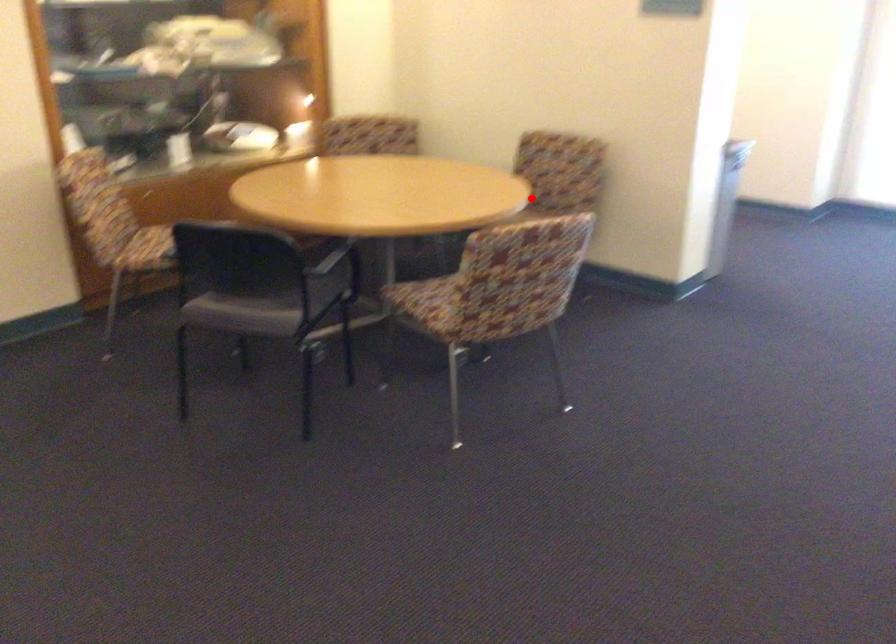
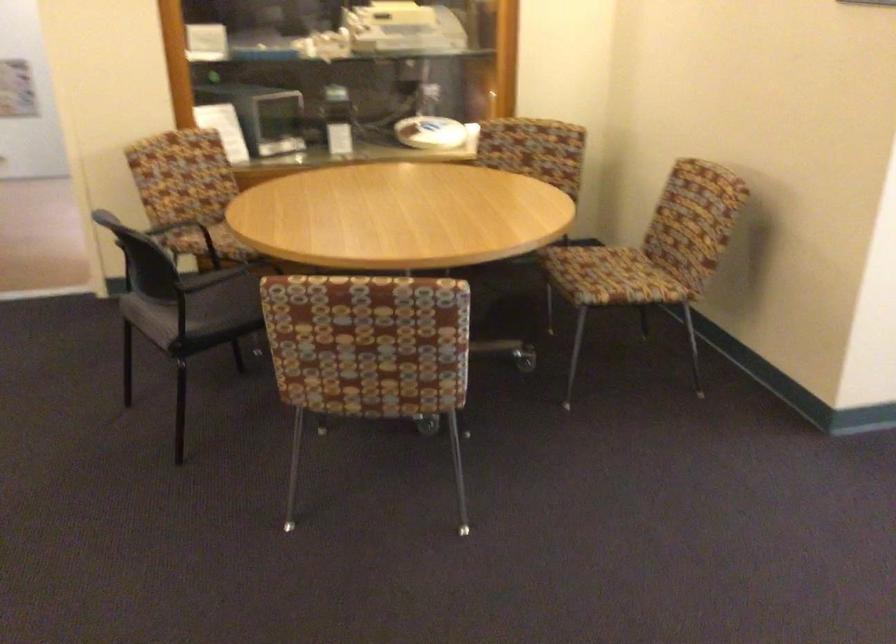
Question: I am providing you with two images of the same scene from different viewpoints. In image1, a red point is highlighted. Considering the same 3D point in image2, which of the following is correct?

Choices:
 (A) It is closer
 (B) It is farther

Answer: (A)